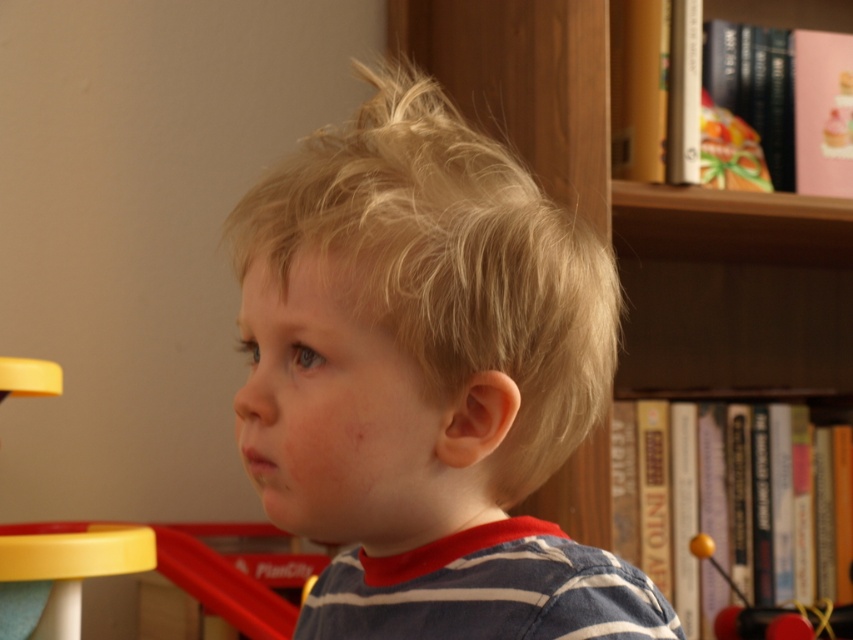
You are a parent trying to retrieve a toy for your child. You see the wooden bookshelf at upper right and the yellow rubber ball at right. Which object is closer to the left side of the room?

The wooden bookshelf at upper right is to the left of the yellow rubber ball at right, so the wooden bookshelf at upper right is closer to the left side of the room.

In the scene shown: Based on the scene description, can you determine if the blonde hair at center is wider than the yellow rubber ball at right?

The blonde hair at center might be wider than yellow rubber ball at right according to the description.